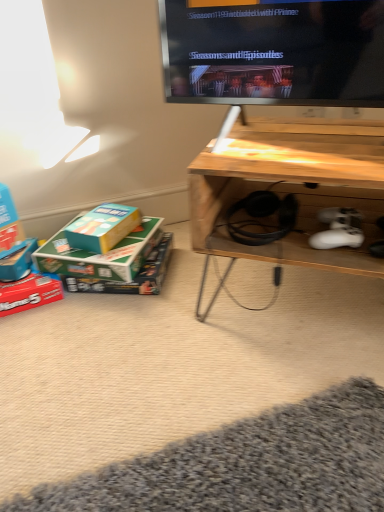
Question: Considering the relative sizes of matte red box at lower left, the 2th box in the left-to-right sequence, and matte blue box at lower left, the first box viewed from the left, in the image provided, is matte red box at lower left, the 2th box in the left-to-right sequence, taller than matte blue box at lower left, the first box viewed from the left,?

Choices:
 (A) no
 (B) yes

Answer: (B)

Question: Is matte red box at lower left, the 2th box in the left-to-right sequence, shorter than matte blue box at lower left, the first box viewed from the left?

Choices:
 (A) no
 (B) yes

Answer: (A)

Question: Considering the relative positions of matte red box at lower left, the 2th box in the left-to-right sequence, and matte blue box at lower left, the first box viewed from the left, in the image provided, is matte red box at lower left, the 2th box in the left-to-right sequence, to the left of matte blue box at lower left, the first box viewed from the left, from the viewer's perspective?

Choices:
 (A) no
 (B) yes

Answer: (A)

Question: Is matte red box at lower left, the 2th box in the left-to-right sequence, looking in the opposite direction of matte blue box at lower left, the first box viewed from the left?

Choices:
 (A) yes
 (B) no

Answer: (B)

Question: Are matte red box at lower left, the third box from the right, and matte blue box at lower left, the first box viewed from the left, located far from each other?

Choices:
 (A) yes
 (B) no

Answer: (B)

Question: Is matte red box at lower left, the third box from the right, further to the viewer compared to matte blue box at lower left, arranged as the fourth box when viewed from the right?

Choices:
 (A) yes
 (B) no

Answer: (B)

Question: Is teal cardboard box at lower left, the fourth box in the left-to-right sequence, closer to camera compared to wooden desk at lower right?

Choices:
 (A) yes
 (B) no

Answer: (B)

Question: From the image's perspective, is teal cardboard box at lower left, the fourth box in the left-to-right sequence, on top of wooden desk at lower right?

Choices:
 (A) no
 (B) yes

Answer: (A)

Question: Can you confirm if teal cardboard box at lower left, arranged as the first box when viewed from the right, is taller than wooden desk at lower right?

Choices:
 (A) no
 (B) yes

Answer: (A)

Question: From a real-world perspective, is teal cardboard box at lower left, the fourth box in the left-to-right sequence, located beneath wooden desk at lower right?

Choices:
 (A) no
 (B) yes

Answer: (B)

Question: Does teal cardboard box at lower left, the fourth box in the left-to-right sequence, have a larger size compared to wooden desk at lower right?

Choices:
 (A) yes
 (B) no

Answer: (B)

Question: Is wooden desk at lower right surrounded by teal cardboard box at lower left, arranged as the first box when viewed from the right?

Choices:
 (A) no
 (B) yes

Answer: (A)

Question: Can you confirm if matte blue box at lower left, the first box viewed from the left, is smaller than green cardboard box at lower left, the third box positioned from the left?

Choices:
 (A) no
 (B) yes

Answer: (B)